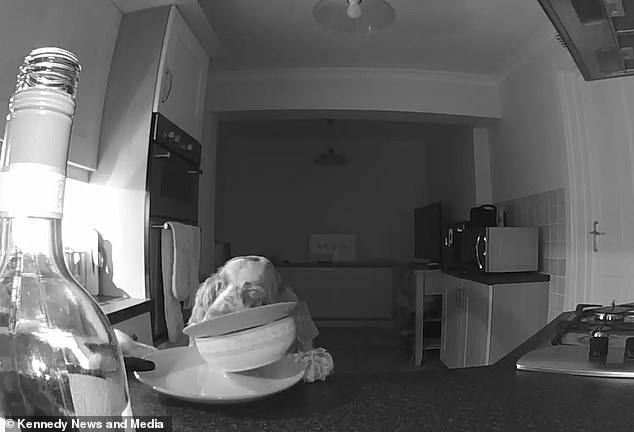
The width and height of the screenshot is (634, 432). Find the location of `white plates`. white plates is located at coordinates (205, 377), (236, 320).